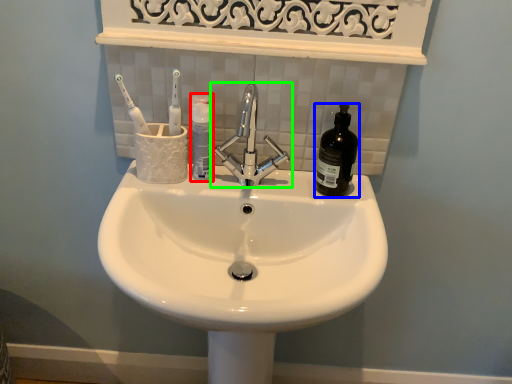
Question: Considering the real-world distances, which object is closest to mouthwash (highlighted by a red box)? mouthwash (highlighted by a blue box) or tap (highlighted by a green box).

Choices:
 (A) mouthwash
 (B) tap

Answer: (B)